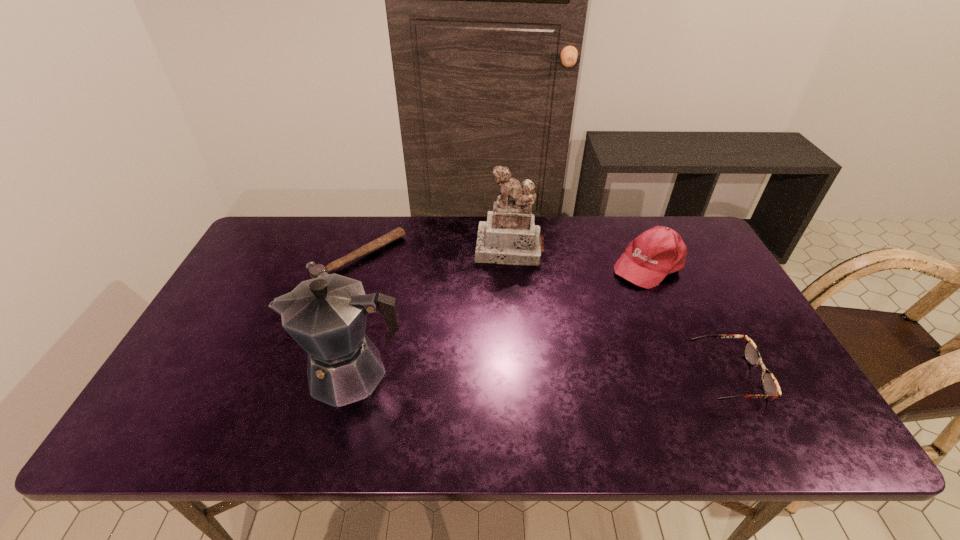
You are a GUI agent. You are given a task and a screenshot of the screen. Output one action in this format:
    pyautogui.click(x=<x>, y=<y>)
    Task: Click on the spectacles at the near edge
    This screenshot has width=960, height=540.
    Given the screenshot: What is the action you would take?
    [x=770, y=386]

Image resolution: width=960 pixels, height=540 pixels. I want to click on spectacles located in the right edge section of the desktop, so click(770, 386).

Where is `baseball cap present at the right edge`? This screenshot has height=540, width=960. baseball cap present at the right edge is located at coordinates (649, 258).

I want to click on object that is at the far right corner, so click(x=649, y=258).

Locate an element on the screen. The height and width of the screenshot is (540, 960). object that is at the near right corner is located at coordinates (770, 386).

Where is `vacant space at the far edge of the desktop`? This screenshot has height=540, width=960. vacant space at the far edge of the desktop is located at coordinates (427, 250).

This screenshot has width=960, height=540. I want to click on blank space at the near edge, so click(x=577, y=388).

You are a GUI agent. You are given a task and a screenshot of the screen. Output one action in this format:
    pyautogui.click(x=<x>, y=<y>)
    Task: Click on the vacant space at the right edge of the desktop
    
    Given the screenshot: What is the action you would take?
    pyautogui.click(x=726, y=372)

The image size is (960, 540). In order to click on free space at the near right corner of the desktop in this screenshot , I will do `click(744, 391)`.

You are a GUI agent. You are given a task and a screenshot of the screen. Output one action in this format:
    pyautogui.click(x=<x>, y=<y>)
    Task: Click on the free area in between the spectacles and the figurine
    The height and width of the screenshot is (540, 960).
    Given the screenshot: What is the action you would take?
    pyautogui.click(x=619, y=313)